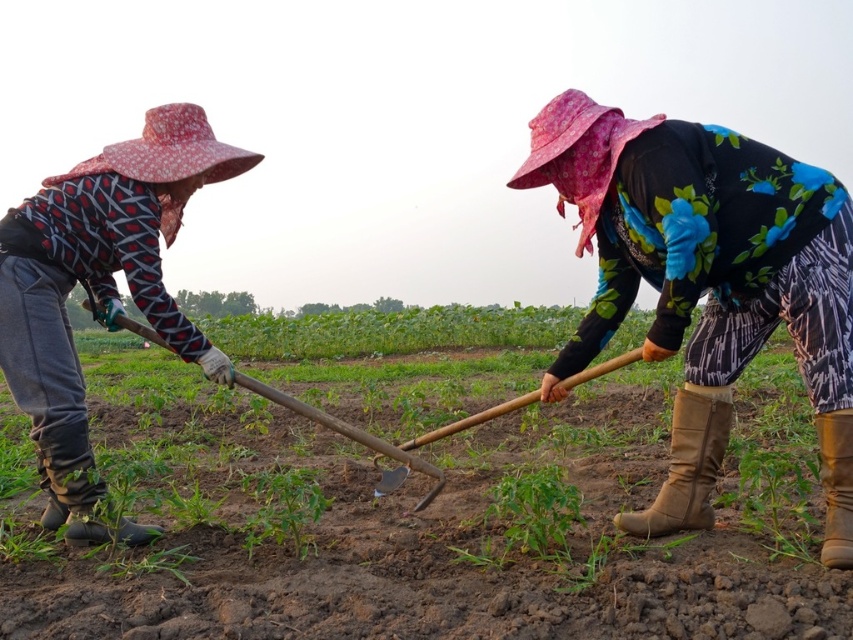
Where is `brown leather boot at lower right`? The width and height of the screenshot is (853, 640). brown leather boot at lower right is located at coordinates (688, 465).

Is point (706, 529) positioned before point (100, 524)?

No, it is behind (100, 524).

Which is in front, point (688, 528) or point (79, 454)?

Point (79, 454)

What are the coordinates of `brown leather boot at lower right` in the screenshot? It's located at (688, 465).

Which is above, floral-patterned fabric at center or brown leather boot at lower right?

floral-patterned fabric at center is above.

Does floral-patterned fabric at center lie in front of brown leather boot at lower right?

That is True.

Identify the location of floral-patterned fabric at center. (698, 268).

Locate an element on the screen. The image size is (853, 640). floral-patterned fabric at center is located at coordinates (698, 268).

Describe the element at coordinates (80, 490) in the screenshot. I see `black rubber boot at lower left` at that location.

Does black rubber boot at lower left appear over brown suede boot at lower right?

Incorrect, black rubber boot at lower left is not positioned above brown suede boot at lower right.

Who is more distant from viewer, (80, 468) or (846, 422)?

Positioned behind is point (80, 468).

At what (x,y) coordinates should I click in order to perform the action: click on black rubber boot at lower left. Please return your answer as a coordinate pair (x, y). The height and width of the screenshot is (640, 853). Looking at the image, I should click on (80, 490).